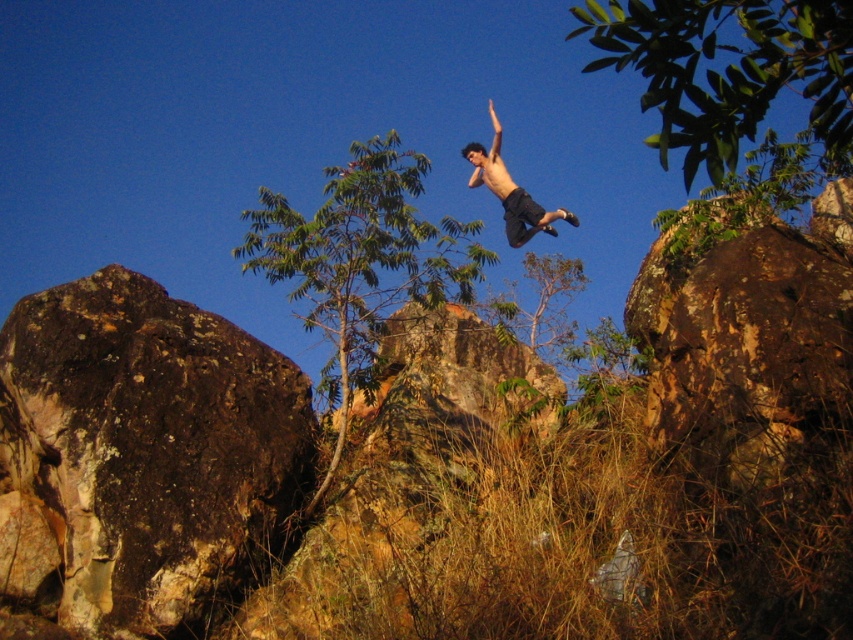
You are a hiker trying to navigate between the brown rough boulder at right and the green leafy tree at center. Which object is taller and would provide a better vantage point for viewing the surrounding area?

The brown rough boulder at right is much taller than the green leafy tree at center, so it would provide a better vantage point for viewing the surrounding area.

You are a hiker planning to take a photo of the brown rough boulder at right and the green leafy tree at center from the left side of the scene. Which object will appear closer to the left edge of your photo?

The green leafy tree at center is positioned to the left of the brown rough boulder at right, so it will appear closer to the left edge of the photo.